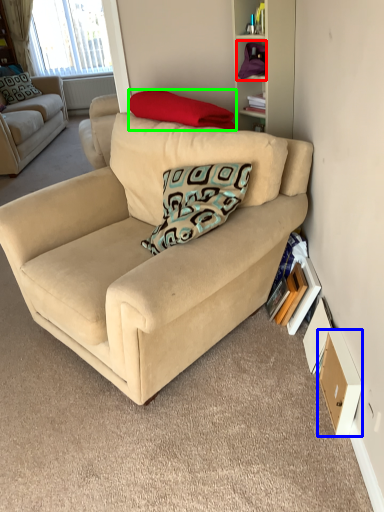
Question: Estimate the real-world distances between objects in this image. Which object is closer to shelf (highlighted by a red box), drawer (highlighted by a blue box) or pillow (highlighted by a green box)?

Choices:
 (A) drawer
 (B) pillow

Answer: (B)